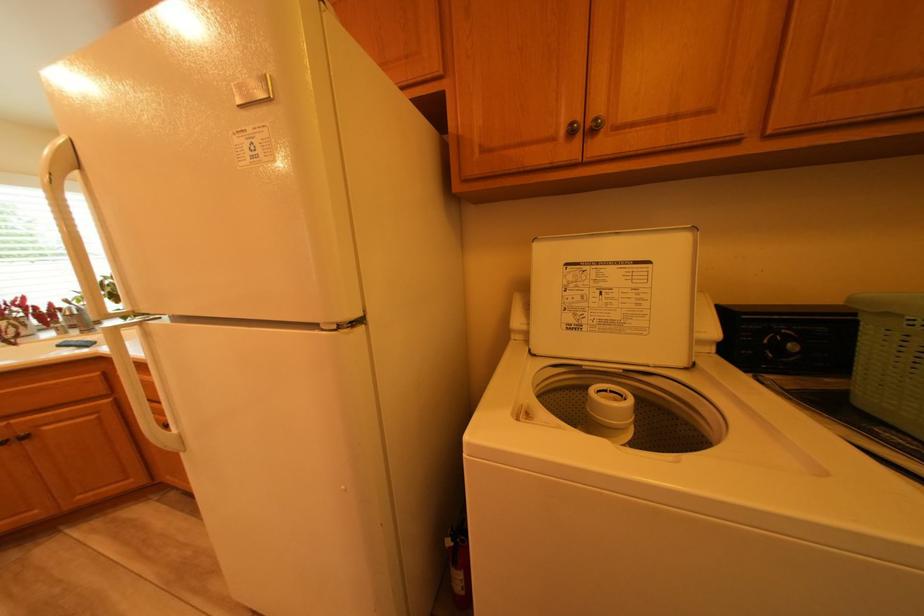
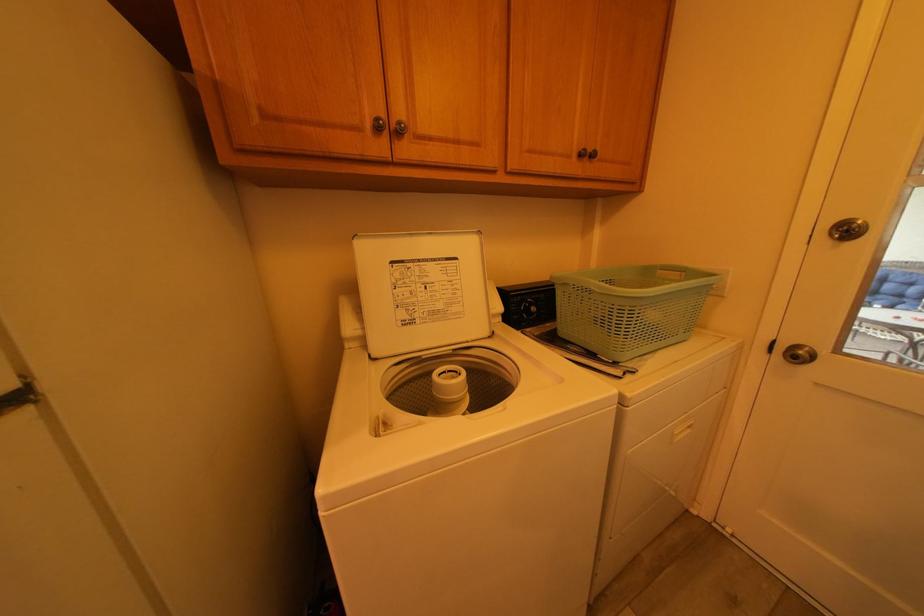
In the second image, find the point that corresponds to pixel 590 310 in the first image.

(420, 306)